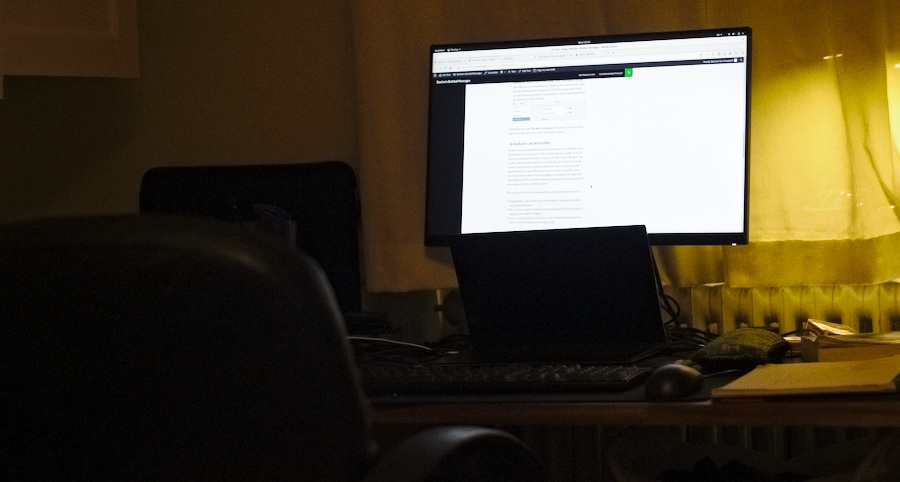
Where is `cords and cables`? Image resolution: width=900 pixels, height=482 pixels. cords and cables is located at coordinates (382, 335), (685, 329), (668, 311), (695, 343), (795, 332).